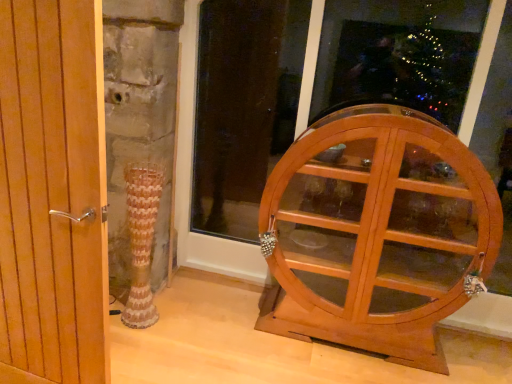
Question: Is light brown wooden cabinet at right at the right side of wooden door handle at left?

Choices:
 (A) yes
 (B) no

Answer: (A)

Question: Considering the relative sizes of light brown wooden cabinet at right and wooden door handle at left in the image provided, is light brown wooden cabinet at right smaller than wooden door handle at left?

Choices:
 (A) no
 (B) yes

Answer: (A)

Question: Considering the relative sizes of light brown wooden cabinet at right and wooden door handle at left in the image provided, is light brown wooden cabinet at right wider than wooden door handle at left?

Choices:
 (A) no
 (B) yes

Answer: (B)

Question: Is light brown wooden cabinet at right outside of wooden door handle at left?

Choices:
 (A) no
 (B) yes

Answer: (B)

Question: Does light brown wooden cabinet at right have a lesser height compared to wooden door handle at left?

Choices:
 (A) yes
 (B) no

Answer: (A)

Question: From a real-world perspective, is light brown wooden cabinet at right below wooden door handle at left?

Choices:
 (A) yes
 (B) no

Answer: (A)

Question: Considering the relative positions of wooden cabinet at right and wooden door handle at left in the image provided, is wooden cabinet at right to the right of wooden door handle at left from the viewer's perspective?

Choices:
 (A) no
 (B) yes

Answer: (B)

Question: Can you see wooden cabinet at right touching wooden door handle at left?

Choices:
 (A) yes
 (B) no

Answer: (B)

Question: From the image's perspective, does wooden cabinet at right appear lower than wooden door handle at left?

Choices:
 (A) no
 (B) yes

Answer: (A)

Question: Does wooden cabinet at right have a larger size compared to wooden door handle at left?

Choices:
 (A) no
 (B) yes

Answer: (B)

Question: From a real-world perspective, is wooden cabinet at right physically above wooden door handle at left?

Choices:
 (A) yes
 (B) no

Answer: (A)

Question: Is wooden cabinet at right at the left side of wooden door handle at left?

Choices:
 (A) no
 (B) yes

Answer: (A)

Question: Considering the relative positions of wooden door handle at left and wooden cabinet at right in the image provided, is wooden door handle at left to the right of wooden cabinet at right from the viewer's perspective?

Choices:
 (A) no
 (B) yes

Answer: (A)